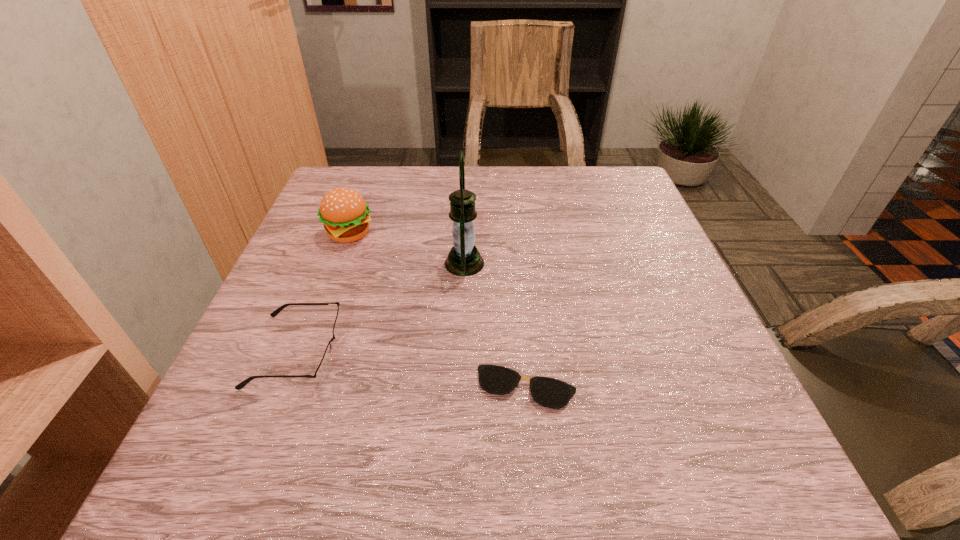
I want to click on lantern, so click(464, 259).

Find the location of `the third shortest object`. the third shortest object is located at coordinates (345, 214).

Identify the location of the left spectacles. This screenshot has height=540, width=960. (324, 366).

Identify the location of the taller spectacles. (324, 366).

Locate an element on the screen. This screenshot has height=540, width=960. the shorter spectacles is located at coordinates (552, 393).

Identify the location of the shortest object. (552, 393).

The width and height of the screenshot is (960, 540). What are the coordinates of `free space located 0.140m on the side where the tallest object emits light` in the screenshot? It's located at (548, 264).

Identify the location of vacant area situated 0.110m on the back of the third shortest object. This screenshot has height=540, width=960. (363, 195).

I want to click on free location located on the front-facing side of the taller spectacles, so click(x=434, y=351).

Image resolution: width=960 pixels, height=540 pixels. Identify the location of vacant space situated 0.170m on the left of the shorter spectacles. (374, 388).